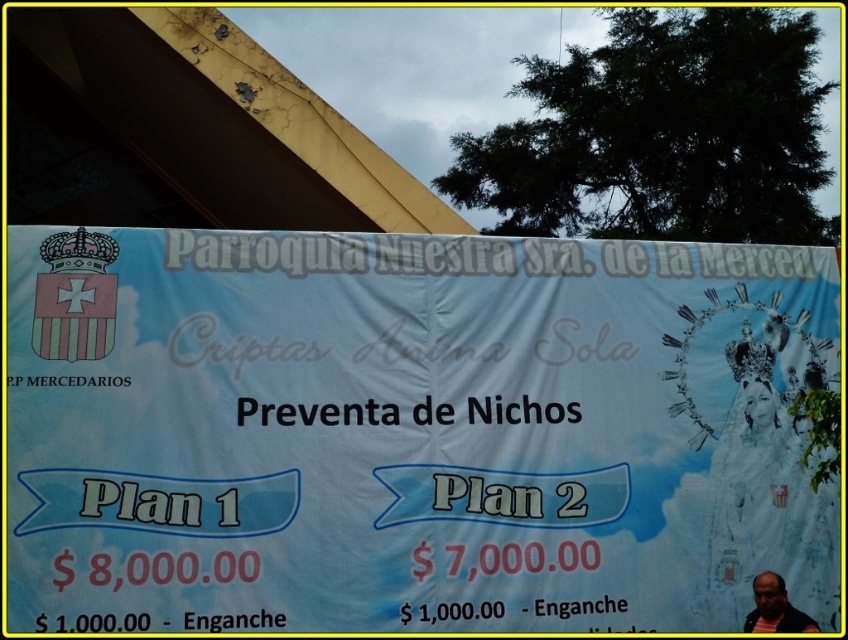
Between white paper banner at center and striped shirt at lower right, which one is positioned lower?

striped shirt at lower right is below.

Between white paper banner at center and striped shirt at lower right, which one appears on the right side from the viewer's perspective?

striped shirt at lower right

This screenshot has width=848, height=640. What do you see at coordinates (411, 432) in the screenshot?
I see `white paper banner at center` at bounding box center [411, 432].

At what (x,y) coordinates should I click in order to perform the action: click on white paper banner at center. Please return your answer as a coordinate pair (x, y). Looking at the image, I should click on (411, 432).